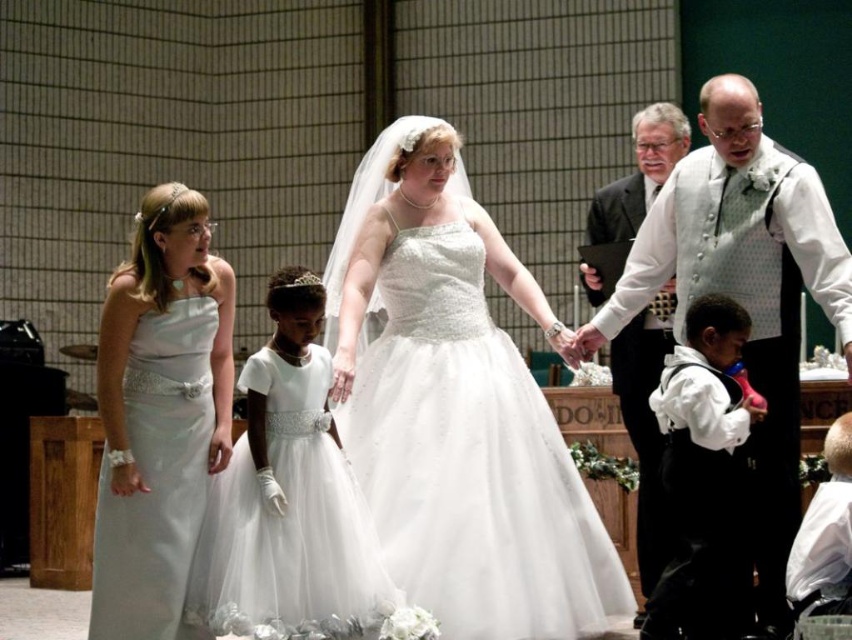
Based on the photo, you are attending a wedding and see two vests in the image. The white dotted vest at center and the black satin vest at right. Which vest is taller?

The white dotted vest at center is taller than the black satin vest at right.

In the church wedding scene, there is a satin white dress at left and a black satin vest at right. From the perspective of someone standing in front of the scene, which object is positioned higher?

The satin white dress at left is above the black satin vest at right, so the satin white dress at left is positioned higher.

You are a photographer standing at the back of the church. You need to capture a photo that includes both the white satin dress at center and the white dotted vest at center. Based on their positions, which one should you focus on first to ensure both are in frame?

The white satin dress at center is located below the white dotted vest at center. Since the dress is lower in the frame, you should focus on the vest first and adjust the camera angle downward to include the dress in the shot.